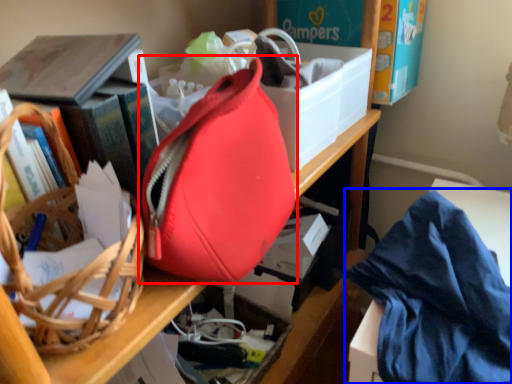
Question: Among these objects, which one is nearest to the camera, handbag (highlighted by a red box) or clothe (highlighted by a blue box)?

Choices:
 (A) handbag
 (B) clothe

Answer: (A)